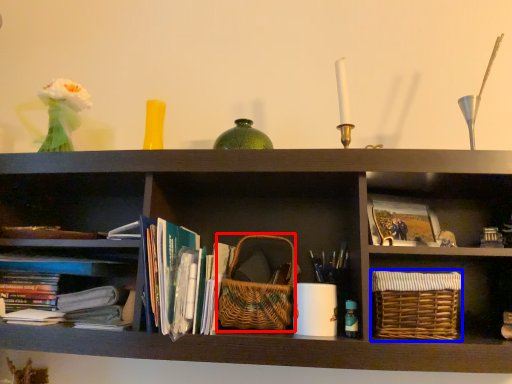
Question: Which object is further to the camera taking this photo, basket (highlighted by a red box) or basket (highlighted by a blue box)?

Choices:
 (A) basket
 (B) basket

Answer: (A)